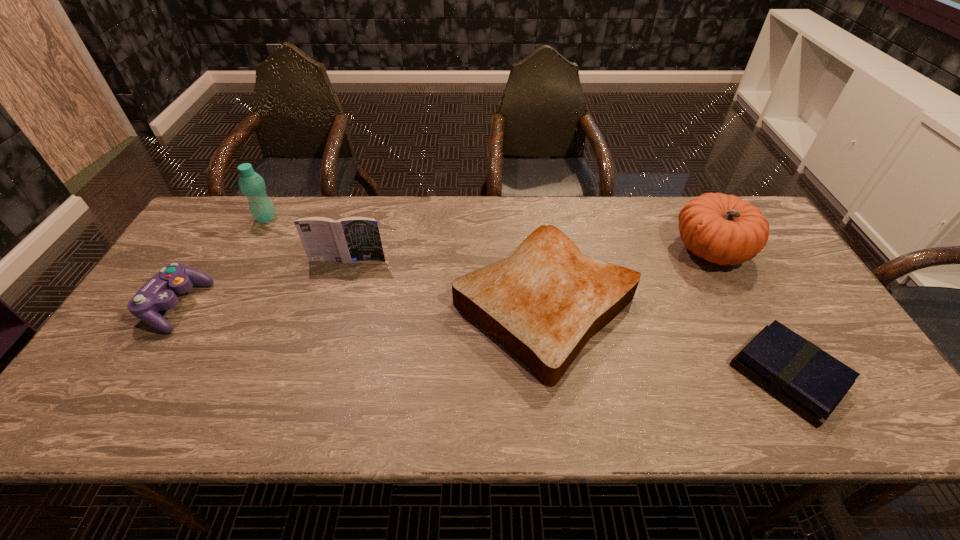
This screenshot has width=960, height=540. I want to click on pumpkin positioned at the right edge, so click(723, 229).

At what (x,y) coordinates should I click in order to perform the action: click on book that is at the right edge. Please return your answer as a coordinate pair (x, y). Looking at the image, I should click on (800, 374).

At what (x,y) coordinates should I click in order to perform the action: click on object that is at the far left corner. Please return your answer as a coordinate pair (x, y). The height and width of the screenshot is (540, 960). Looking at the image, I should click on (252, 185).

I want to click on object at the far right corner, so click(723, 229).

At what (x,y) coordinates should I click in order to perform the action: click on object that is positioned at the near right corner. Please return your answer as a coordinate pair (x, y). Looking at the image, I should click on (800, 374).

In the image, there is a desktop. Identify the location of blank space at the far edge. This screenshot has height=540, width=960. (471, 242).

Find the location of a particular element. Image resolution: width=960 pixels, height=540 pixels. vacant space at the near edge is located at coordinates (217, 404).

You are a GUI agent. You are given a task and a screenshot of the screen. Output one action in this format:
    pyautogui.click(x=<x>, y=<y>)
    Task: Click on the vacant space at the left edge of the desktop
    
    Given the screenshot: What is the action you would take?
    pos(240,244)

Where is `vacant space at the far right corner of the desktop`? The width and height of the screenshot is (960, 540). vacant space at the far right corner of the desktop is located at coordinates (696, 195).

I want to click on empty location between the leftmost object and the nearer book, so click(482, 341).